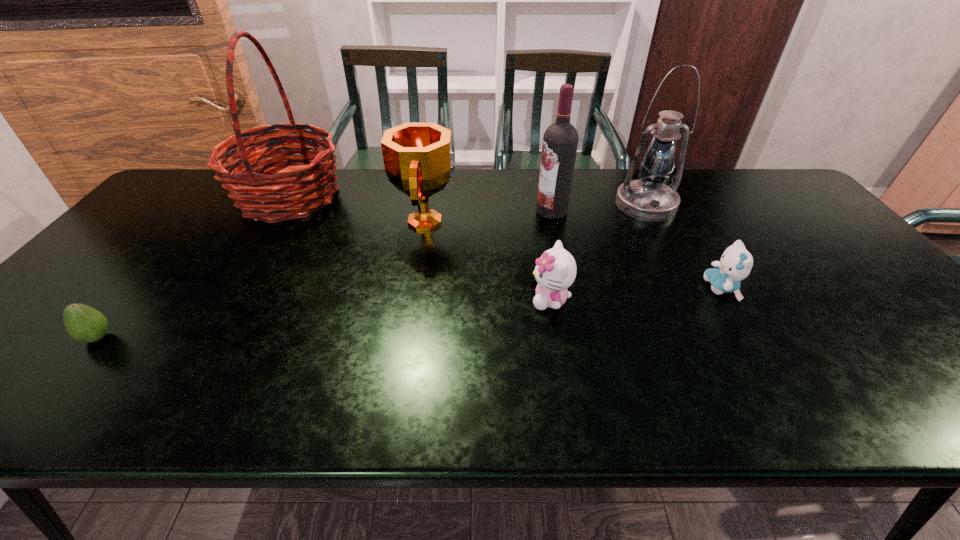
The image size is (960, 540). I want to click on free space located 0.090m on the left of the sixth object from right to left, so click(204, 197).

Where is `free space located on the front of the oil lamp`? Image resolution: width=960 pixels, height=540 pixels. free space located on the front of the oil lamp is located at coordinates (664, 240).

This screenshot has width=960, height=540. In order to click on vacant area located 0.060m on the label of the wine bottle in this screenshot , I will do `click(516, 211)`.

This screenshot has height=540, width=960. In order to click on vacant space located on the label of the wine bottle in this screenshot , I will do `click(468, 211)`.

The image size is (960, 540). I want to click on vacant position located on the label of the wine bottle, so click(491, 211).

Find the location of `free location located on the side of the fifth object from right to left with the star emblem`. free location located on the side of the fifth object from right to left with the star emblem is located at coordinates (514, 221).

Locate an element on the screen. Image resolution: width=960 pixels, height=540 pixels. vacant space located 0.180m on the front-facing side of the left kitten is located at coordinates (457, 299).

Identify the location of vacant space situated 0.070m on the front-facing side of the left kitten. This screenshot has width=960, height=540. (502, 299).

In order to click on vacant position located 0.320m on the front-facing side of the left kitten in this screenshot , I will do `click(399, 299)`.

You are a GUI agent. You are given a task and a screenshot of the screen. Output one action in this format:
    pyautogui.click(x=<x>, y=<y>)
    Task: Click on the free region located 0.210m on the face of the second shortest object
    Image resolution: width=960 pixels, height=540 pixels.
    Given the screenshot: What is the action you would take?
    pyautogui.click(x=622, y=288)